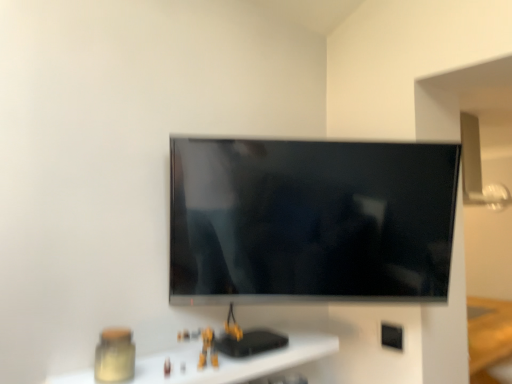
Question: Considering the positions of black plastic electric outlet at lower right and flat screen tv at center in the image, is black plastic electric outlet at lower right wider or thinner than flat screen tv at center?

Choices:
 (A) thin
 (B) wide

Answer: (A)

Question: Is point (394, 332) closer or farther from the camera than point (295, 271)?

Choices:
 (A) farther
 (B) closer

Answer: (A)

Question: Which of these objects is positioned farthest from the matte glass jar at lower left?

Choices:
 (A) black plastic electric outlet at lower right
 (B) flat screen tv at center

Answer: (A)

Question: Which object is positioned closest to the matte glass jar at lower left?

Choices:
 (A) black plastic electric outlet at lower right
 (B) flat screen tv at center

Answer: (B)